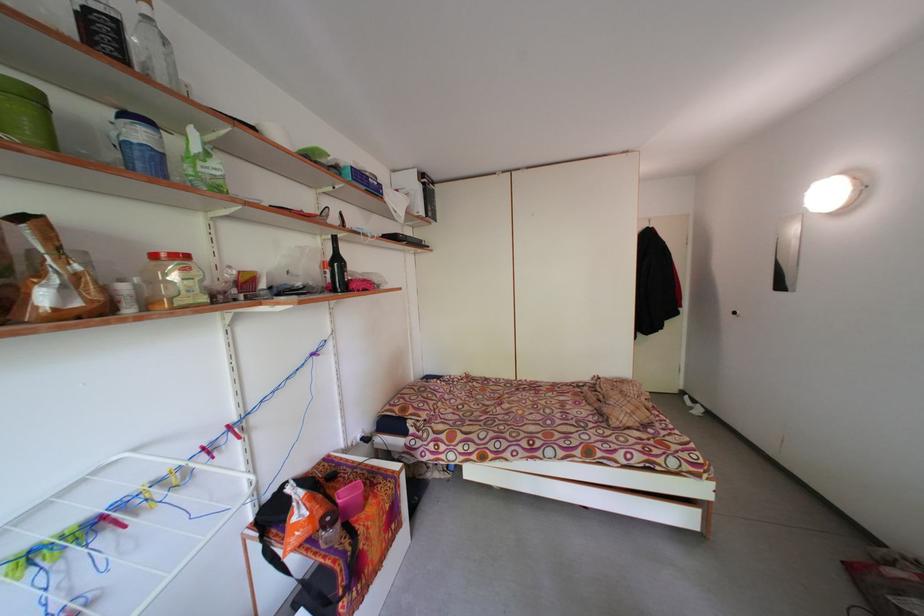
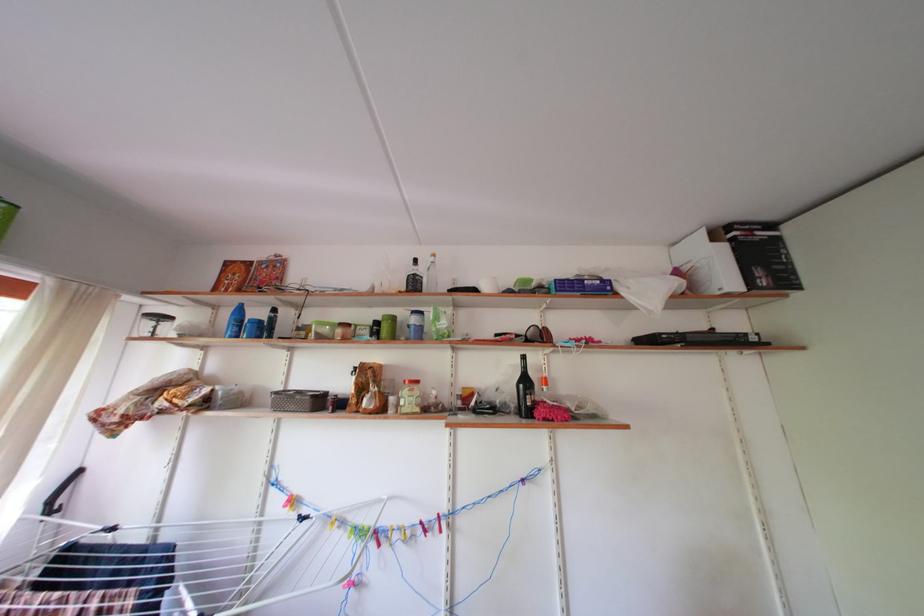
In the second image, find the point that corresponds to point 438,216 in the first image.

(768, 278)